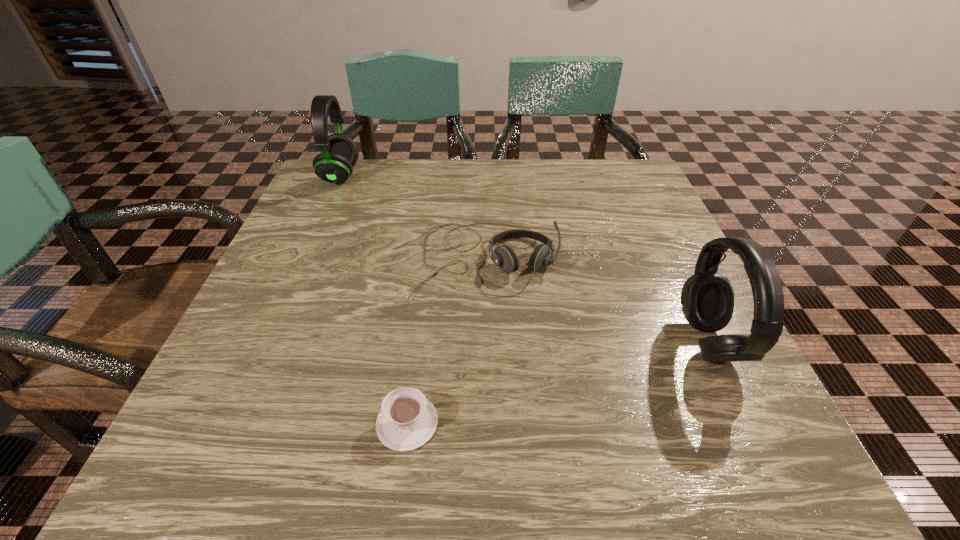
Where is `vacant space at the far edge of the desktop`? vacant space at the far edge of the desktop is located at coordinates (399, 170).

Locate an element on the screen. The width and height of the screenshot is (960, 540). free space at the near edge of the desktop is located at coordinates (468, 463).

Locate an element on the screen. vacant space at the left edge of the desktop is located at coordinates 348,281.

In the image, there is a desktop. Identify the location of vacant space at the right edge. (603, 241).

Find the location of `vacant position at the far left corner of the desktop`. vacant position at the far left corner of the desktop is located at coordinates (304, 203).

The width and height of the screenshot is (960, 540). In the image, there is a desktop. In order to click on free space at the far right corner in this screenshot , I will do `click(616, 167)`.

The image size is (960, 540). In the image, there is a desktop. Identify the location of vacant space at the near right corner. (682, 450).

You are a GUI agent. You are given a task and a screenshot of the screen. Output one action in this format:
    pyautogui.click(x=<x>, y=<y>)
    Task: Click on the vacant space that is in between the shortest object and the rightmost object
    
    Given the screenshot: What is the action you would take?
    pyautogui.click(x=558, y=382)

The height and width of the screenshot is (540, 960). Find the location of `free space between the nearest object and the rightmost object`. free space between the nearest object and the rightmost object is located at coordinates (558, 382).

Locate an element on the screen. free space between the farthest headset and the rightmost headset is located at coordinates (524, 259).